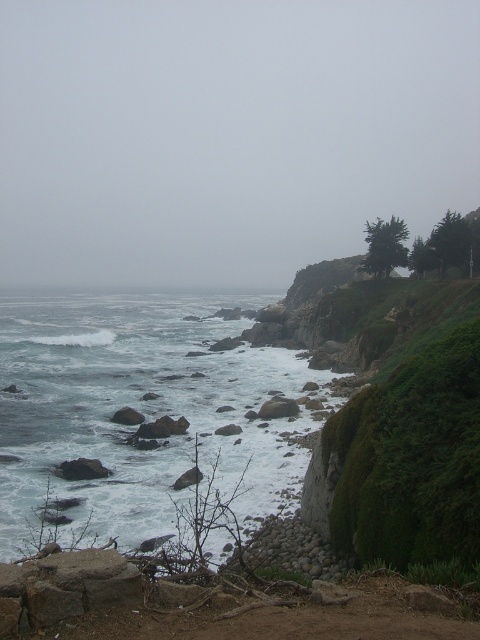
You are a hiker trying to navigate the coastal path. You see the foggy sky at upper center and the white frothy water at lower left. Which object is located to the left of the other?

The foggy sky at upper center is positioned on the left side of white frothy water at lower left.

You are a hiker standing on the cliff edge looking out at the ocean. You notice a specific point in the sky that might be a weather indicator. Which object in the scene corresponds to the coordinates point (227,134)?

The foggy sky at upper center is located at point (227,134).